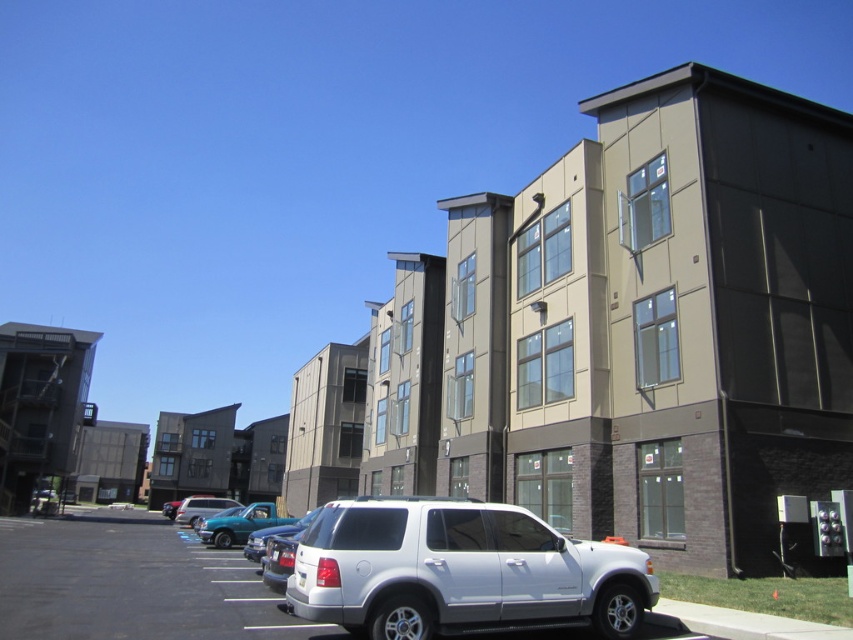
Question: Which of these objects is positioned farthest from the white matte suv at center?

Choices:
 (A) matte silver suv at center
 (B) teal glossy truck at lower left

Answer: (A)

Question: Is teal glossy truck at lower left positioned in front of matte silver suv at center?

Choices:
 (A) yes
 (B) no

Answer: (A)

Question: Which of the following is the closest to the observer?

Choices:
 (A) (204, 529)
 (B) (228, 502)

Answer: (A)

Question: Does white matte suv at center appear under matte silver suv at center?

Choices:
 (A) yes
 (B) no

Answer: (B)

Question: Which of the following is the farthest from the observer?

Choices:
 (A) (236, 522)
 (B) (206, 500)
 (C) (339, 598)

Answer: (B)

Question: Can you confirm if white matte suv at center is positioned to the left of matte silver suv at center?

Choices:
 (A) no
 (B) yes

Answer: (A)